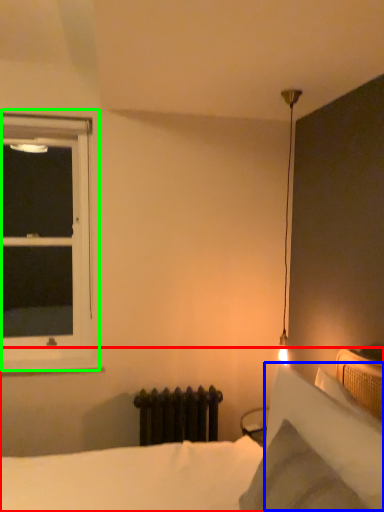
Question: Which object is the closest to the bed (highlighted by a red box)? Choose among these: pillow (highlighted by a blue box) or window (highlighted by a green box).

Choices:
 (A) pillow
 (B) window

Answer: (A)